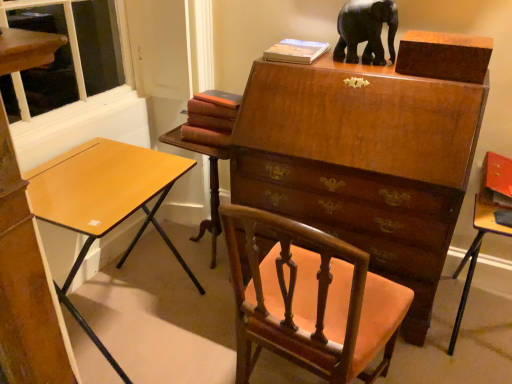
The height and width of the screenshot is (384, 512). Find the location of `vacant space underneath matte orange table at right, which is the 1th table from right to left (from a real-world perspective)`. vacant space underneath matte orange table at right, which is the 1th table from right to left (from a real-world perspective) is located at coordinates (475, 332).